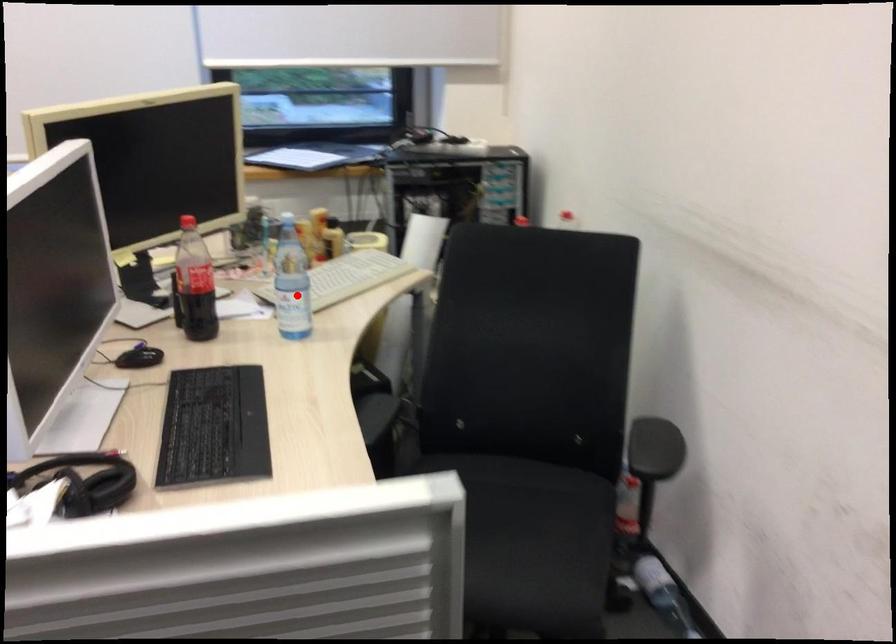
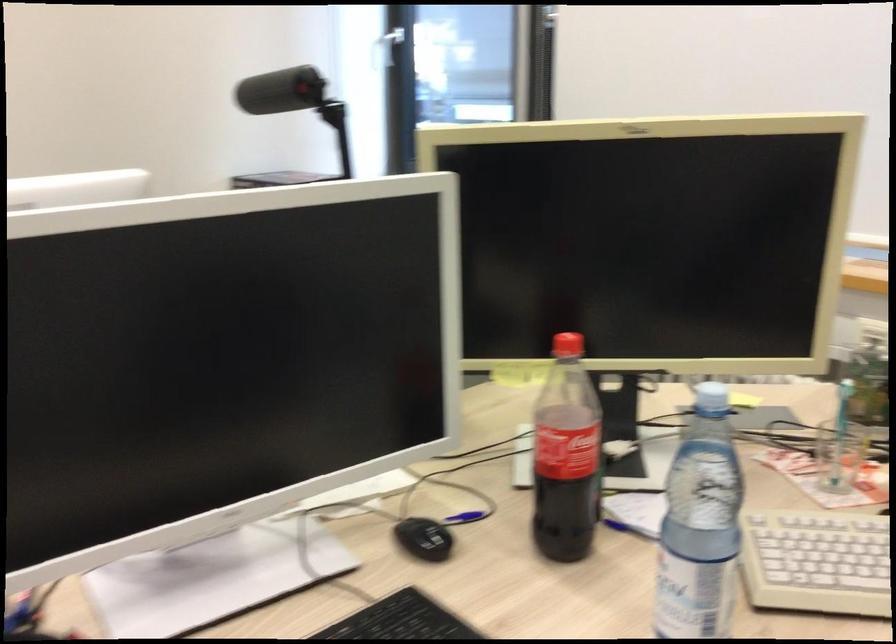
In the second image, find the point that corresponds to the highlighted location in the first image.

(815, 562)